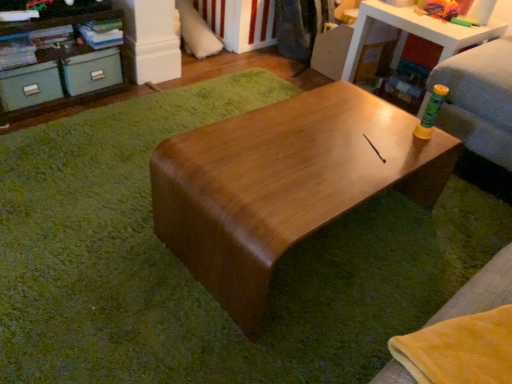
Question: Considering the positions of matte green drawer at left, acting as the 2th drawer starting from the right, and shiny brown table at upper right, marked as the 1th table in a right-to-left arrangement, in the image, is matte green drawer at left, acting as the 2th drawer starting from the right, taller or shorter than shiny brown table at upper right, marked as the 1th table in a right-to-left arrangement,?

Choices:
 (A) tall
 (B) short

Answer: (B)

Question: Is matte green drawer at left, acting as the 2th drawer starting from the right, in front of or behind shiny brown table at upper right, which is counted as the first table, starting from the back, in the image?

Choices:
 (A) behind
 (B) front

Answer: (B)

Question: Which object is the closest to the shiny brown table at upper right, acting as the second table starting from the left?

Choices:
 (A) shiny brown table at center, which is the 1th table from bottom to top
 (B) soft yellow fabric couch at lower right
 (C) matte green drawer at left, the first drawer positioned from the left
 (D) matte green drawer at left, the 1th drawer from the right
 (E) matte teal storage boxes at upper left

Answer: (A)

Question: Estimate the real-world distances between objects in this image. Which object is closer to the matte green drawer at left, the first drawer positioned from the left?

Choices:
 (A) shiny brown table at center, placed as the 2th table when sorted from back to front
 (B) soft yellow fabric couch at lower right
 (C) matte green drawer at left, the 1th drawer from the right
 (D) shiny brown table at upper right, the second table positioned from the bottom
 (E) matte teal storage boxes at upper left

Answer: (E)